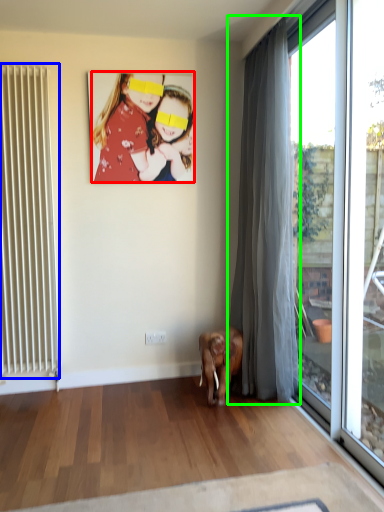
Question: Which object is positioned farthest from person (highlighted by a red box)? Select from radiator (highlighted by a blue box) and curtain (highlighted by a green box).

Choices:
 (A) radiator
 (B) curtain

Answer: (B)